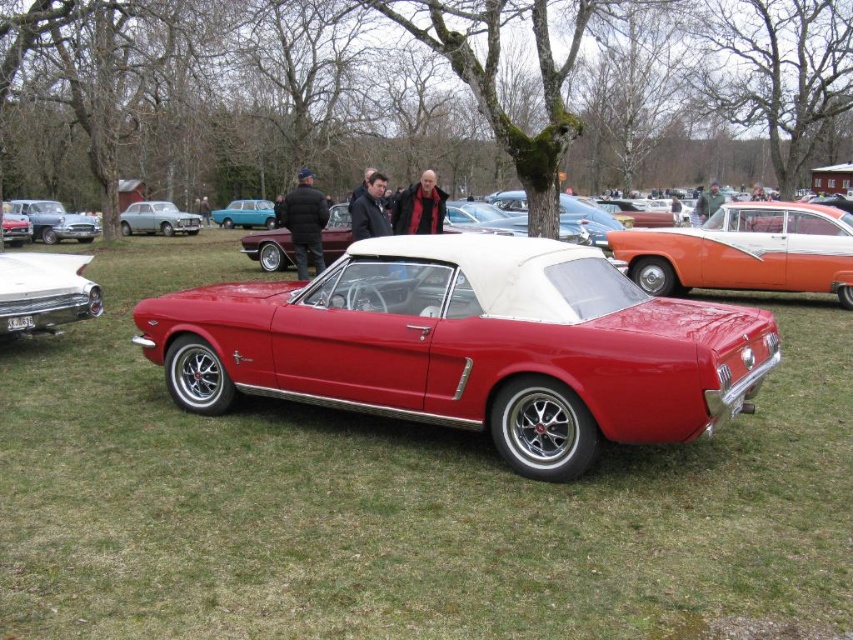
You are standing at the point with coordinates point (41, 301) and want to walk towards the point with coordinates point (740, 349). According to the scene, will you pass by the vibrant red 1960s Ford Mustang convertible with a white soft top?

Yes, you will pass by the vibrant red 1960s Ford Mustang convertible with a white soft top because point (740, 349) is in front of point (41, 301), meaning the path between them would go past the central car.

You are a photographer at the car show and want to place both the black leather jacket at center and the dark red leather jacket at center on a table for a photo. If the table can only hold items up to 1 meter in width, which jacket should you choose to ensure it fits?

The black leather jacket at center might be wider than the dark red leather jacket at center, so to ensure it fits on the table, you should choose the dark red leather jacket at center.

Based on the photo, you are standing at the point labeled point (314, 237) at a classic car show. You want to take a photo of the red 1960s Ford Mustang convertible with a white soft top. If your camera has a focal length of 50mm and you are 11.56 meters away from the car, what is the approximate angle of view required to capture the entire car in the frame?

Result: The angle of view required to capture the entire car would depend on the camera sensor size and the car dimensions. However, since the distance is 11.56 meters and focal length is 50mm, using the formula angle of view formula, the angle would be approximately 2 times arctangent of sensor width divided by 2 times focal length. Without exact sensor dimensions, a rough estimate suggests a wide angle lens around 35mm or lower might be needed.